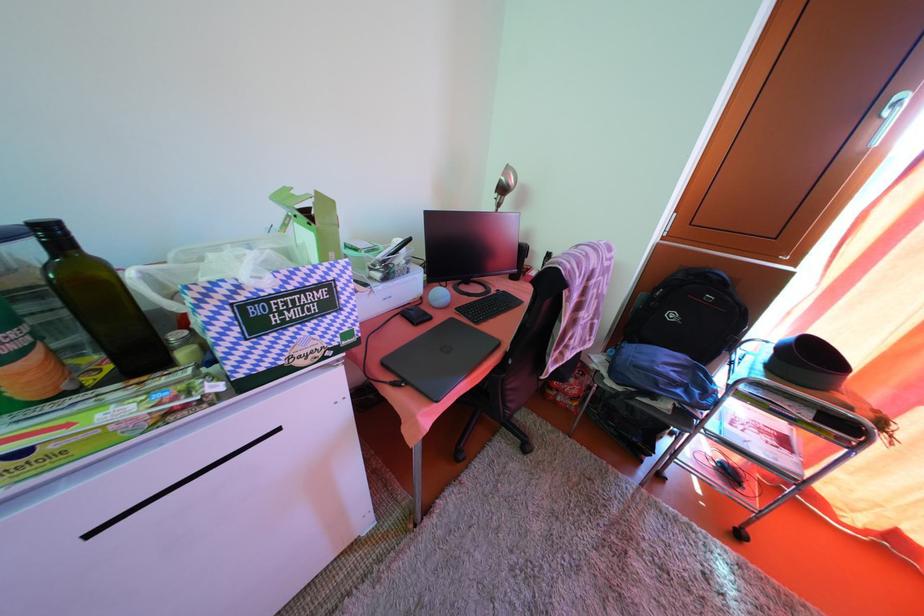
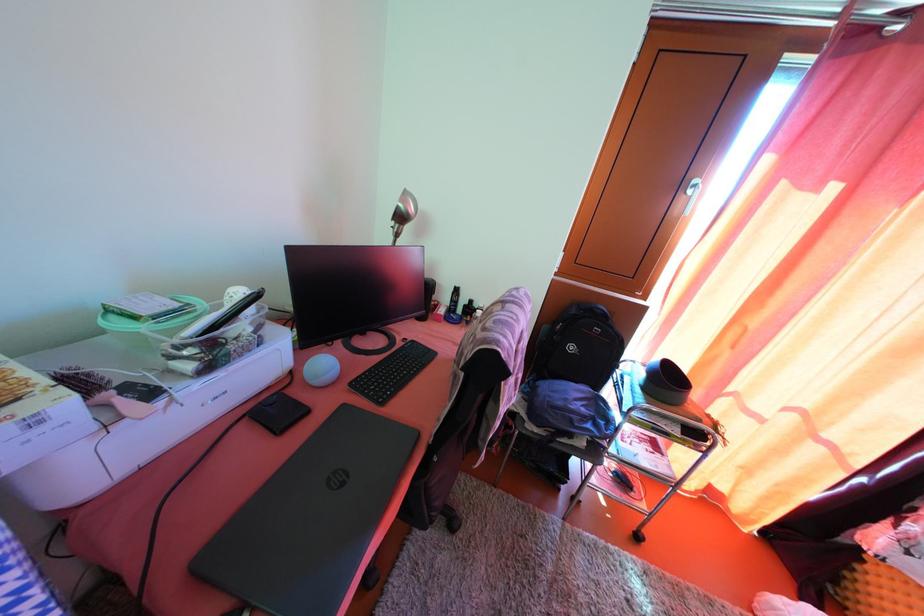
Question: The camera is either moving clockwise (left) or counter-clockwise (right) around the object. The first image is from the beginning of the video and the second image is from the end. Is the camera moving left or right when shooting the video?

Choices:
 (A) Left
 (B) Right

Answer: (A)